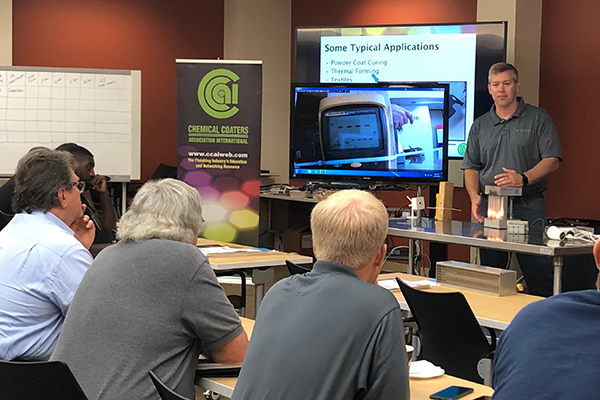
Where is `devices on table`? This screenshot has height=400, width=600. devices on table is located at coordinates (x=498, y=216), (x=521, y=225).